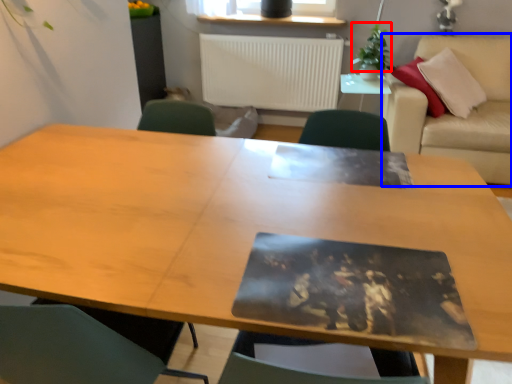
Question: Among these objects, which one is nearest to the camera, plant (highlighted by a red box) or couch (highlighted by a blue box)?

Choices:
 (A) plant
 (B) couch

Answer: (B)